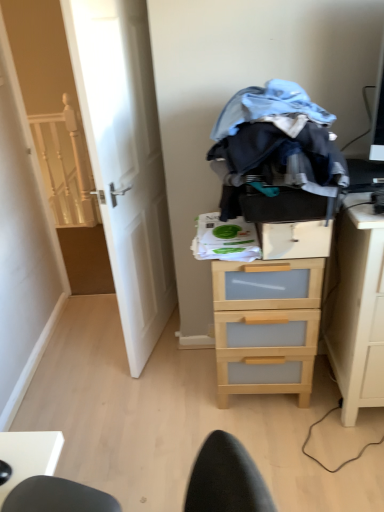
Identify the location of vacant area situated to the left side of light wood/transparent drawer at center. (182, 402).